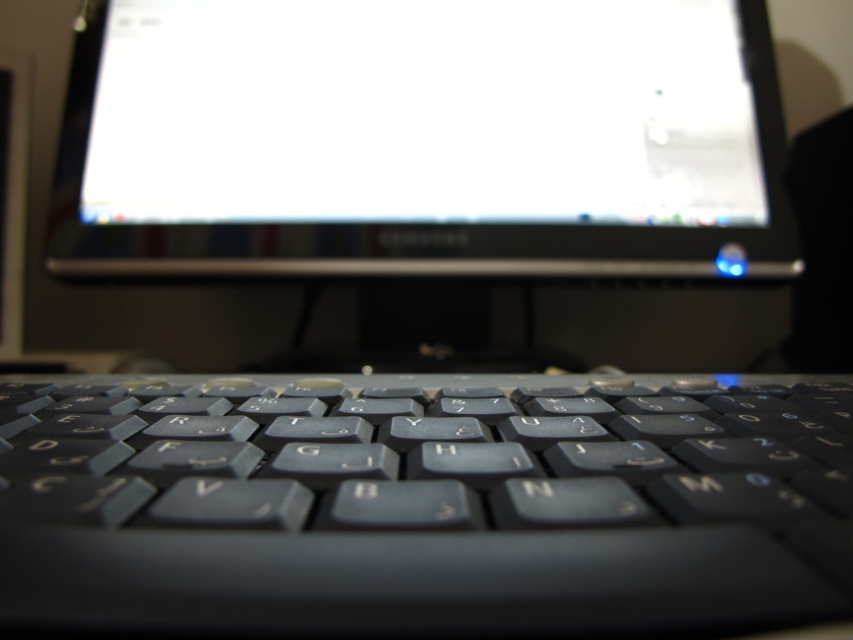
You are setting up a new laptop and need to place the matte black keyboard at center and the satin black monitor at center on a desk. Given their thickness, which one should you place closer to the edge of the desk to prevent it from hanging over?

The matte black keyboard at center is thinner than the satin black monitor at center, so you should place the satin black monitor at center closer to the edge of the desk to prevent it from hanging over since it is thicker and more likely to protrude over the edge.

You are setting up a new laptop and want to ensure proper ergonomics. The matte black keyboard at center and the satin black monitor at center need to be positioned so that your arms and eyes are at a comfortable angle. Based on their current positions, which object should you adjust to achieve this?

The matte black keyboard at center is located below the satin black monitor at center. To achieve proper ergonomics, you should adjust the satin black monitor at center to ensure it is at eye level while keeping the matte black keyboard at center at a comfortable typing height.

You are trying to navigate between two points on the laptop keyboard shown in the image. The points are labeled as point (x=489, y=570) and point (x=187, y=154). If you move from the point closer to you to the one further away, which point will you end up at?

Point (x=489, y=570) is in front of point (x=187, y=154). Therefore, moving from the closer point to the further one would mean starting at point (x=489, y=570) and ending at point (x=187, y=154).